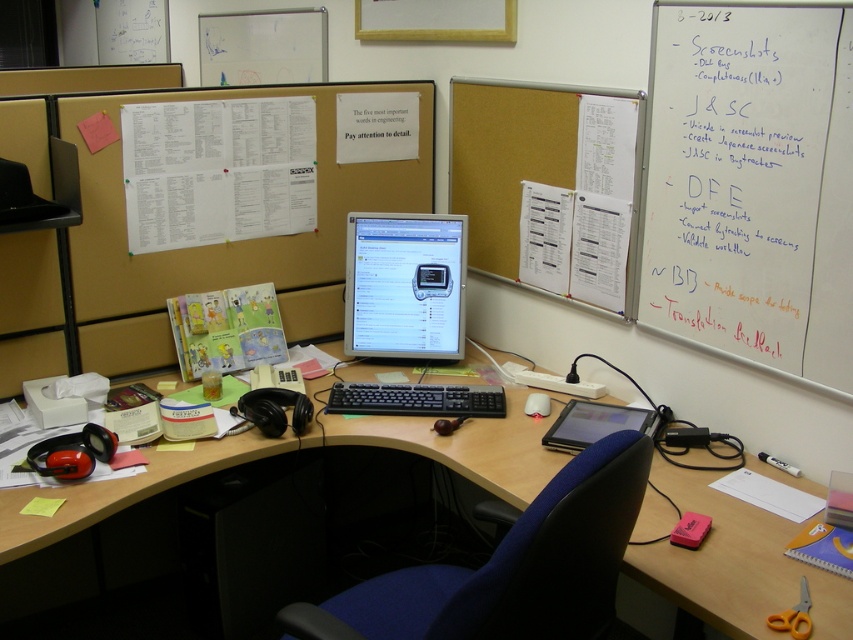
Question: Based on their relative distances, which object is farther from the black plastic keyboard at center?

Choices:
 (A) whiteboard at upper right
 (B) matte plastic monitor at center

Answer: (A)

Question: Is whiteboard at upper right below matte plastic monitor at center?

Choices:
 (A) no
 (B) yes

Answer: (A)

Question: Is matte plastic monitor at center positioned in front of black plastic keyboard at center?

Choices:
 (A) no
 (B) yes

Answer: (A)

Question: Is matte black monitor at center wider than blue fabric swivel chair at center?

Choices:
 (A) no
 (B) yes

Answer: (B)

Question: Which of the following is the closest to the observer?

Choices:
 (A) matte black monitor at center
 (B) matte plastic monitor at center
 (C) whiteboard at upper right

Answer: (A)

Question: Which of the following is the closest to the observer?

Choices:
 (A) matte plastic monitor at center
 (B) matte black monitor at center
 (C) black plastic keyboard at center

Answer: (B)